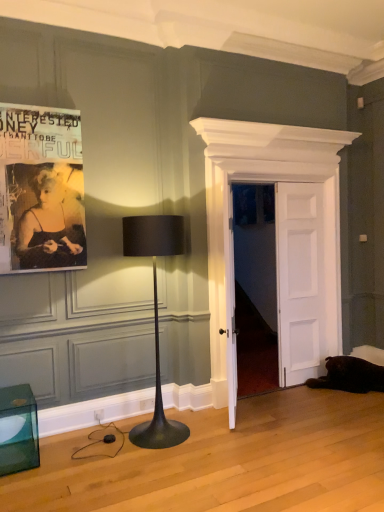
You are a GUI agent. You are given a task and a screenshot of the screen. Output one action in this format:
    pyautogui.click(x=<x>, y=<y>)
    Task: Click on the white wooden door at center, the first door when ordered from left to right
    This screenshot has height=512, width=384.
    Given the screenshot: What is the action you would take?
    pyautogui.click(x=230, y=232)

Locate an element on the screen. matte black lamp at center-left is located at coordinates (155, 316).

Which is in front, white wooden door at center, which is the first door from right to left, or matte black lamp at center-left?

Positioned in front is matte black lamp at center-left.

This screenshot has width=384, height=512. What are the coordinates of `lamp located on the left of white wooden door at center, which is the first door from right to left` in the screenshot? It's located at (155, 316).

From a real-world perspective, is white wooden door at center, which is the 2th door in left-to-right order, located beneath matte black lamp at center-left?

No.

Could you measure the distance between white wooden door at center, which is the 2th door in left-to-right order, and matte black lamp at center-left?

white wooden door at center, which is the 2th door in left-to-right order, is 5.18 feet from matte black lamp at center-left.

Consider the image. Is transparent glass cube at lower left directly adjacent to white wooden door at center, which ranks as the second door in right-to-left order?

No, transparent glass cube at lower left is not making contact with white wooden door at center, which ranks as the second door in right-to-left order.

Is point (21, 417) closer to viewer compared to point (350, 143)?

Yes, it is in front of point (350, 143).

Does transparent glass cube at lower left have a greater height compared to white wooden door at center, which ranks as the second door in right-to-left order?

No.

From a real-world perspective, which object rests below the other?

transparent glass cube at lower left is physically lower.

How far apart are matte black lamp at center-left and white wooden door at center, the first door when ordered from left to right?

matte black lamp at center-left and white wooden door at center, the first door when ordered from left to right, are 1.26 meters apart.

How different are the orientations of matte black lamp at center-left and white wooden door at center, which ranks as the second door in right-to-left order, in degrees?

The facing directions of matte black lamp at center-left and white wooden door at center, which ranks as the second door in right-to-left order, are 0.216 degrees apart.

Which is further, (163, 242) or (269, 168)?

The point (269, 168) is farther.

Based on the photo, is matte black lamp at center-left bigger than white wooden door at center, the first door when ordered from left to right?

Yes.

Considering the sizes of transparent glass cube at lower left and matte black lamp at center-left in the image, is transparent glass cube at lower left wider or thinner than matte black lamp at center-left?

In the image, transparent glass cube at lower left appears to be more narrow than matte black lamp at center-left.

Would you say transparent glass cube at lower left is to the left or to the right of matte black lamp at center-left in the picture?

Clearly, transparent glass cube at lower left is on the left of matte black lamp at center-left in the image.

Measure the distance between transparent glass cube at lower left and matte black lamp at center-left.

35.68 inches.

Considering the points (8, 406) and (159, 372), which point is behind, point (8, 406) or point (159, 372)?

Point (159, 372)

Considering the positions of point (287, 341) and point (309, 148), is point (287, 341) closer or farther from the camera than point (309, 148)?

Point (287, 341) appears to be farther away from the viewer than point (309, 148).

Between white wooden door at center, which is the first door from right to left, and white wooden door at center, which ranks as the second door in right-to-left order, which one has less height?

white wooden door at center, which is the first door from right to left.

In the scene shown: Is white wooden door at center, which is the first door from right to left, far from white wooden door at center, which ranks as the second door in right-to-left order?

No, white wooden door at center, which is the first door from right to left, is in close proximity to white wooden door at center, which ranks as the second door in right-to-left order.

How much distance is there between white wooden door at center, which is the 2th door in left-to-right order, and white wooden door at center, the first door when ordered from left to right?

16.94 inches.

Is white wooden door at center, the first door when ordered from left to right, placed right next to transparent glass cube at lower left?

No, white wooden door at center, the first door when ordered from left to right, is not with transparent glass cube at lower left.

Can you confirm if white wooden door at center, the first door when ordered from left to right, is shorter than transparent glass cube at lower left?

Incorrect, the height of white wooden door at center, the first door when ordered from left to right, does not fall short of that of transparent glass cube at lower left.

Is white wooden door at center, the first door when ordered from left to right, at the left side of transparent glass cube at lower left?

Incorrect, white wooden door at center, the first door when ordered from left to right, is not on the left side of transparent glass cube at lower left.

Is point (320, 159) closer or farther from the camera than point (177, 227)?

Point (320, 159) appears to be farther away from the viewer than point (177, 227).

Between white wooden door at center, the first door when ordered from left to right, and matte black lamp at center-left, which one has larger size?

With larger size is matte black lamp at center-left.

Is white wooden door at center, which ranks as the second door in right-to-left order, next to matte black lamp at center-left and touching it?

There is a gap between white wooden door at center, which ranks as the second door in right-to-left order, and matte black lamp at center-left.

Can you confirm if white wooden door at center, which ranks as the second door in right-to-left order, is shorter than matte black lamp at center-left?

No.

You are a GUI agent. You are given a task and a screenshot of the screen. Output one action in this format:
    pyautogui.click(x=<x>, y=<y>)
    Task: Click on the lamp that appears in front of the white wooden door at center, which is the first door from right to left
    
    Given the screenshot: What is the action you would take?
    pyautogui.click(x=155, y=316)

Image resolution: width=384 pixels, height=512 pixels. I want to click on furniture that appears below the white wooden door at center, the first door when ordered from left to right (from a real-world perspective), so coord(18,430).

Looking at the image, which one is located closer to black paper poster at upper left, matte black lamp at center-left or transparent glass cube at lower left?

Based on the image, matte black lamp at center-left appears to be nearer to black paper poster at upper left.

When comparing their distances from white wooden door at center, which is the 2th door in left-to-right order, does black paper poster at upper left or white wooden door at center, the first door when ordered from left to right, seem closer?

The object closer to white wooden door at center, which is the 2th door in left-to-right order, is white wooden door at center, the first door when ordered from left to right.

When comparing their distances from matte black lamp at center-left, does white wooden door at center, which is the 2th door in left-to-right order, or transparent glass cube at lower left seem closer?

transparent glass cube at lower left is closer to matte black lamp at center-left.

Which object lies nearer to the anchor point matte black lamp at center-left, white wooden door at center, the first door when ordered from left to right, or transparent glass cube at lower left?

Among the two, transparent glass cube at lower left is located nearer to matte black lamp at center-left.

Considering their positions, is black paper poster at upper left positioned further to white wooden door at center, the first door when ordered from left to right, than transparent glass cube at lower left?

transparent glass cube at lower left.

Which object lies further to the anchor point matte black lamp at center-left, transparent glass cube at lower left or white wooden door at center, which ranks as the second door in right-to-left order?

white wooden door at center, which ranks as the second door in right-to-left order, is further to matte black lamp at center-left.

Which object lies nearer to the anchor point black paper poster at upper left, matte black lamp at center-left or white wooden door at center, which is the 2th door in left-to-right order?

Based on the image, matte black lamp at center-left appears to be nearer to black paper poster at upper left.

Looking at the image, which one is located closer to matte black lamp at center-left, white wooden door at center, which is the first door from right to left, or black paper poster at upper left?

black paper poster at upper left is closer to matte black lamp at center-left.

Locate an element on the screen. Image resolution: width=384 pixels, height=512 pixels. door situated between transparent glass cube at lower left and white wooden door at center, which is the 2th door in left-to-right order, from left to right is located at coordinates (230, 232).

Locate an element on the screen. Image resolution: width=384 pixels, height=512 pixels. lamp that lies between black paper poster at upper left and transparent glass cube at lower left from top to bottom is located at coordinates tap(155, 316).

You are a GUI agent. You are given a task and a screenshot of the screen. Output one action in this format:
    pyautogui.click(x=<x>, y=<y>)
    Task: Click on the door located between matte black lamp at center-left and white wooden door at center, which is the 2th door in left-to-right order, in the left-right direction
    
    Given the screenshot: What is the action you would take?
    pyautogui.click(x=230, y=232)

I want to click on picture frame between transparent glass cube at lower left and white wooden door at center, which ranks as the second door in right-to-left order, in the horizontal direction, so click(x=41, y=190).